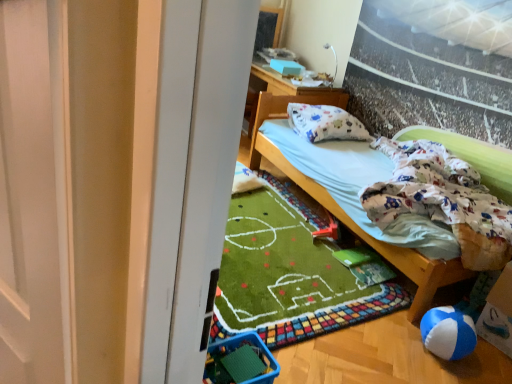
Identify the location of free point above blue plastic baby carriage at lower left (from a real-world perspective). This screenshot has width=512, height=384. (242, 351).